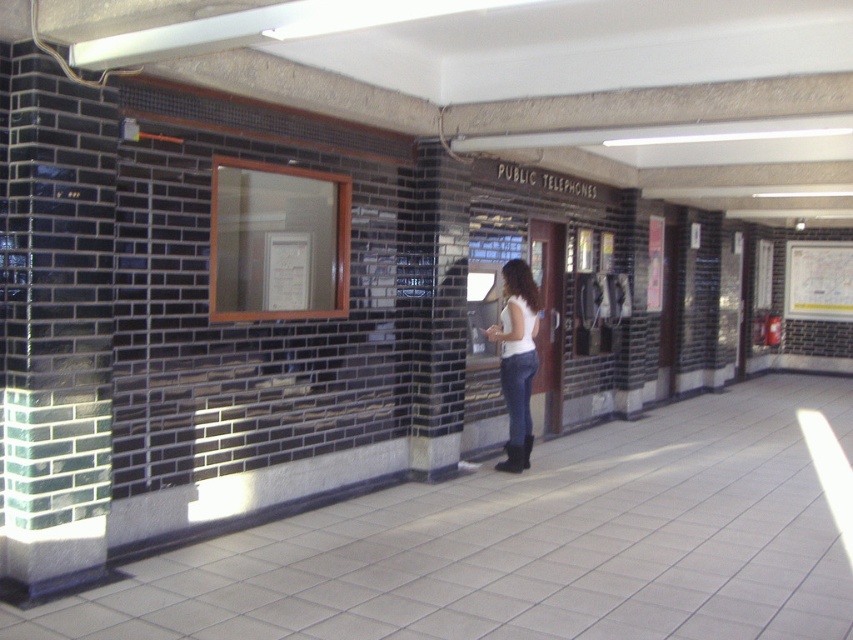
Question: Is black brick pillar at center below white paper map at upper right?

Choices:
 (A) yes
 (B) no

Answer: (A)

Question: Which object appears farthest from the camera in this image?

Choices:
 (A) green glossy pillar at left
 (B) white matte shirt at center

Answer: (B)

Question: Is green glossy pillar at left thinner than white matte shirt at center?

Choices:
 (A) no
 (B) yes

Answer: (A)

Question: Which of the following is the farthest from the observer?

Choices:
 (A) green glossy pillar at left
 (B) black brick pillar at center

Answer: (B)

Question: Which point appears farthest from the camera in this image?

Choices:
 (A) (525, 456)
 (B) (459, 248)
 (C) (786, 292)
 (D) (82, 413)

Answer: (C)

Question: Is black brick pillar at center thinner than white matte shirt at center?

Choices:
 (A) yes
 (B) no

Answer: (B)